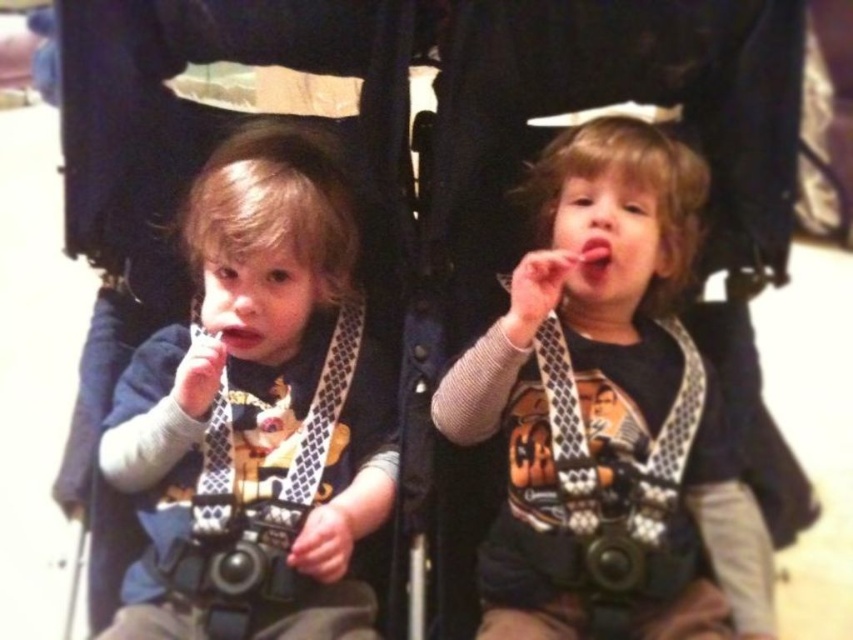
Who is positioned more to the left, matte black bib at left or black textured suspenders at center?

matte black bib at left is more to the left.

Locate an element on the screen. The width and height of the screenshot is (853, 640). matte black bib at left is located at coordinates (257, 413).

Is matte black shirt at center taller than pink matte lips at center?

Yes.

At what (x,y) coordinates should I click in order to perform the action: click on matte black shirt at center. Please return your answer as a coordinate pair (x, y). Looking at the image, I should click on (605, 406).

Between black textured suspenders at center and pink matte lips at center, which one appears on the right side from the viewer's perspective?

black textured suspenders at center is more to the right.

Between point (689, 563) and point (229, 323), which one is positioned in front?

Point (689, 563)

The width and height of the screenshot is (853, 640). Identify the location of black textured suspenders at center. (614, 483).

The width and height of the screenshot is (853, 640). In order to click on black textured suspenders at center in this screenshot , I will do `click(614, 483)`.